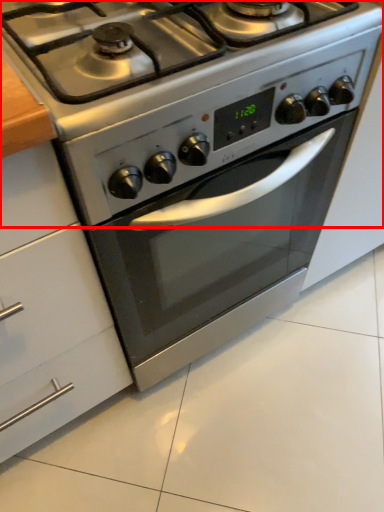
Question: From the image's perspective, considering the relative positions of gas stove (annotated by the red box) and cabinetry in the image provided, where is gas stove (annotated by the red box) located with respect to the staircase?

Choices:
 (A) above
 (B) below

Answer: (A)